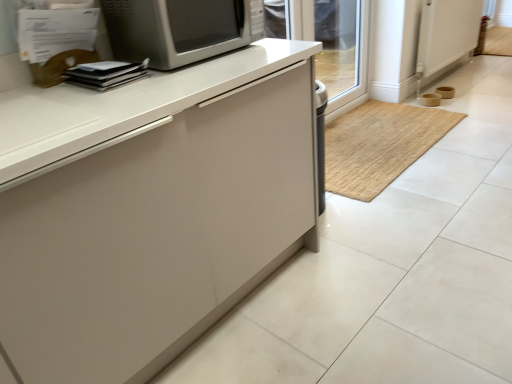
Question: Is matte white cabinet at center in contact with transparent glass door at upper right?

Choices:
 (A) no
 (B) yes

Answer: (A)

Question: From a real-world perspective, is matte white cabinet at center physically below transparent glass door at upper right?

Choices:
 (A) yes
 (B) no

Answer: (A)

Question: Does matte white cabinet at center have a lesser height compared to transparent glass door at upper right?

Choices:
 (A) yes
 (B) no

Answer: (A)

Question: From a real-world perspective, is matte white cabinet at center physically above transparent glass door at upper right?

Choices:
 (A) yes
 (B) no

Answer: (B)

Question: Considering the relative sizes of matte white cabinet at center and transparent glass door at upper right in the image provided, is matte white cabinet at center bigger than transparent glass door at upper right?

Choices:
 (A) no
 (B) yes

Answer: (B)

Question: In the image, is transparent glass door at upper right positioned in front of or behind white plastic screen door at upper right?

Choices:
 (A) front
 (B) behind

Answer: (A)

Question: Which is correct: transparent glass door at upper right is inside white plastic screen door at upper right, or outside of it?

Choices:
 (A) outside
 (B) inside

Answer: (A)

Question: Is point (362, 71) closer or farther from the camera than point (467, 6)?

Choices:
 (A) closer
 (B) farther

Answer: (A)

Question: Considering the relative positions of transparent glass door at upper right and white plastic screen door at upper right in the image provided, is transparent glass door at upper right to the left or to the right of white plastic screen door at upper right?

Choices:
 (A) right
 (B) left

Answer: (B)

Question: From their relative heights in the image, would you say matte white cabinet at center is taller or shorter than bamboo mat at center?

Choices:
 (A) short
 (B) tall

Answer: (B)

Question: Is matte white cabinet at center to the left or to the right of bamboo mat at center in the image?

Choices:
 (A) left
 (B) right

Answer: (B)

Question: Is matte white cabinet at center spatially inside bamboo mat at center, or outside of it?

Choices:
 (A) outside
 (B) inside

Answer: (A)

Question: In terms of size, does matte white cabinet at center appear bigger or smaller than bamboo mat at center?

Choices:
 (A) big
 (B) small

Answer: (A)

Question: From the image's perspective, is white plastic screen door at upper right positioned above or below transparent glass door at upper right?

Choices:
 (A) below
 (B) above

Answer: (B)

Question: Is white plastic screen door at upper right wider or thinner than transparent glass door at upper right?

Choices:
 (A) thin
 (B) wide

Answer: (A)